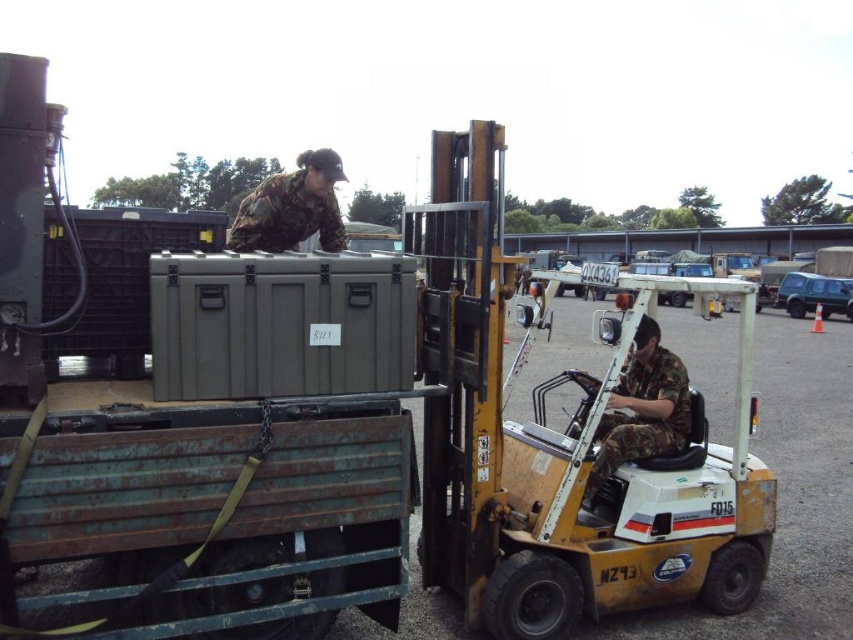
You are a military logistics officer inspecting the loading operation. You notice two individuals in camouflage fabric uniforms. Which of the two, the camouflage fabric uniform at center or the camouflage fabric uniform at upper center, appears to be closer to the container being loaded?

The camouflage fabric uniform at center is closer to the container being loaded because it occupies less space compared to the camouflage fabric uniform at upper center, indicating it is nearer in the scene.

You are a military logistics officer assessing the loading operation. You need to ensure that the camouflage fabric uniform at center is at least 15 feet away from the camera for safety. Based on the scene, is the current distance compliant with the safety requirement?

The camouflage fabric uniform at center and camera are 13.38 feet apart, which is less than the required 15 feet. The current distance does not comply with the safety requirement.